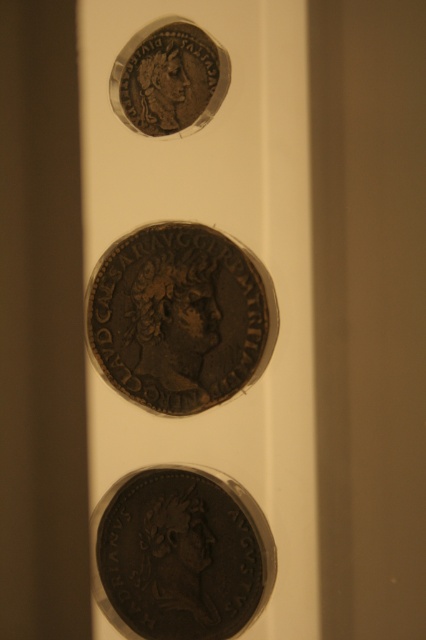
Who is lower down, dark brown metallic coin at center or dark brown metal coin at center?

dark brown metal coin at center is lower down.

Is dark brown metallic coin at center bigger than dark brown metal coin at center?

Indeed, dark brown metallic coin at center has a larger size compared to dark brown metal coin at center.

Between point (103, 362) and point (184, 600), which one is positioned behind?

The point (103, 362) is behind.

At what (x,y) coordinates should I click in order to perform the action: click on dark brown metallic coin at center. Please return your answer as a coordinate pair (x, y). The width and height of the screenshot is (426, 640). Looking at the image, I should click on (180, 317).

Between dark brown metal coin at center and bronze coin at upper center, which one appears on the right side from the viewer's perspective?

Positioned to the right is dark brown metal coin at center.

Is point (146, 506) closer to viewer compared to point (192, 124)?

No, (146, 506) is behind (192, 124).

You are a GUI agent. You are given a task and a screenshot of the screen. Output one action in this format:
    pyautogui.click(x=<x>, y=<y>)
    Task: Click on the dark brown metal coin at center
    The width and height of the screenshot is (426, 640).
    Given the screenshot: What is the action you would take?
    pyautogui.click(x=181, y=554)

Does point (160, 307) come farther from viewer compared to point (187, 96)?

No, it is not.

The image size is (426, 640). In order to click on dark brown metallic coin at center in this screenshot , I will do `click(180, 317)`.

Locate an element on the screen. dark brown metallic coin at center is located at coordinates (180, 317).